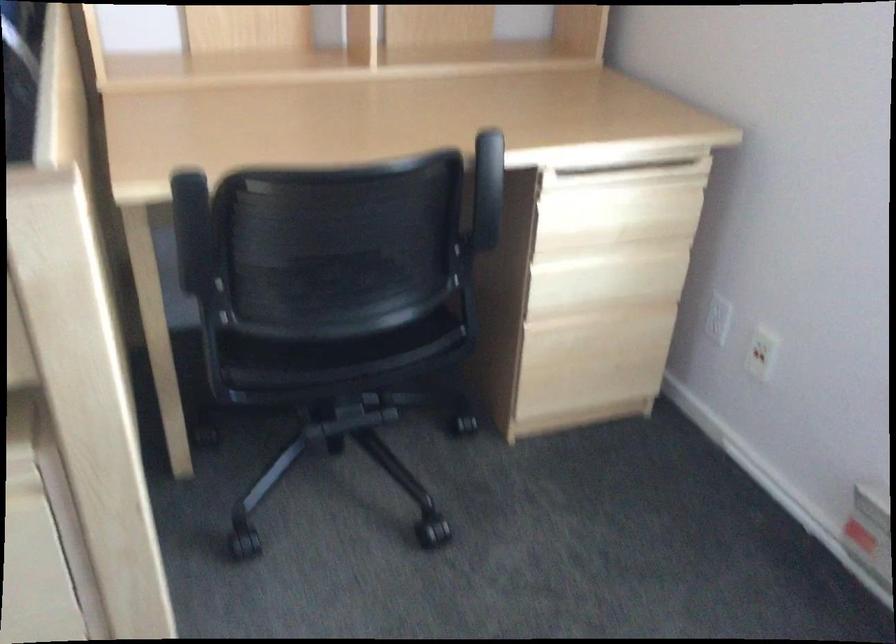
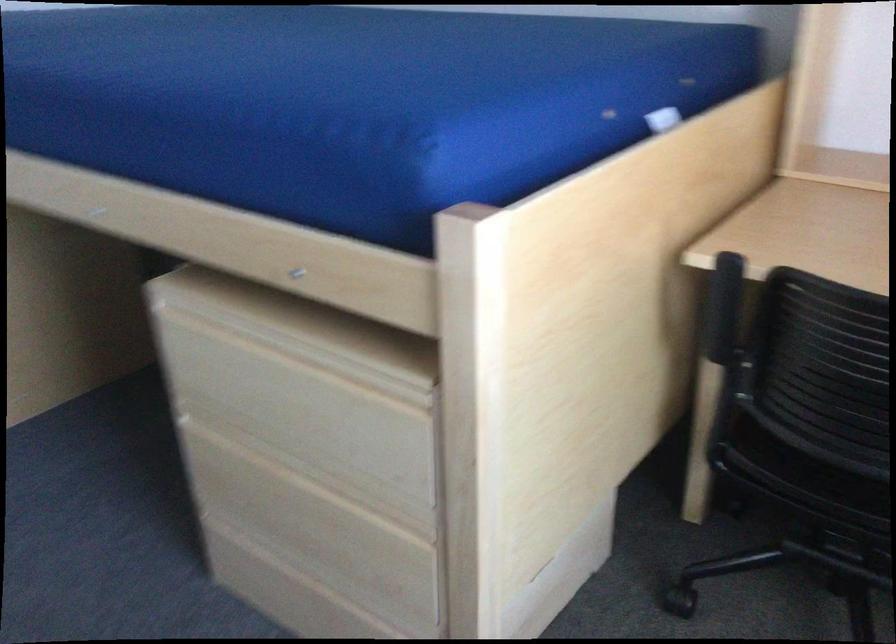
Question: The images are taken continuously from a first-person perspective. In which direction is your viewpoint rotating?

Choices:
 (A) Left
 (B) Right
 (C) Up
 (D) Down

Answer: (A)